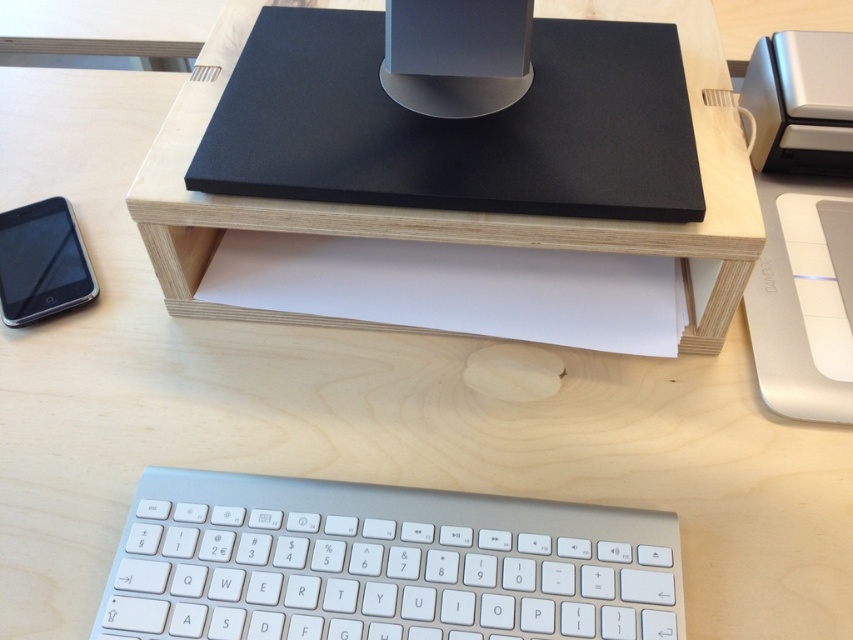
You are a delivery person who needs to place a new keyboard on the desk without moving the matte black speaker at center. The new keyboard is 12 inches long. Can you fit it on the desk? Please explain your reasoning based on the available space.

The distance between the matte black speaker at center and the camera is 21.34 inches. Since the new keyboard is only 12 inches long, there is sufficient space to place it on the desk without moving the speaker.

You are organizing your desk and want to place the matte black speaker at center closer to the edge of the desk. However, you notice the matte black smartphone at lower left is in the way. Can you move the speaker without moving the smartphone?

The matte black speaker at center is in front of the matte black smartphone at lower left, so you can move the speaker towards the edge of the desk without disturbing the smartphone since it is behind the speaker.